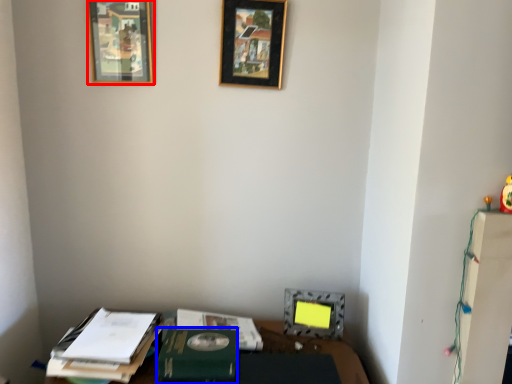
Question: Among these objects, which one is farthest to the camera, picture frame (highlighted by a red box) or paperback book (highlighted by a blue box)?

Choices:
 (A) picture frame
 (B) paperback book

Answer: (A)